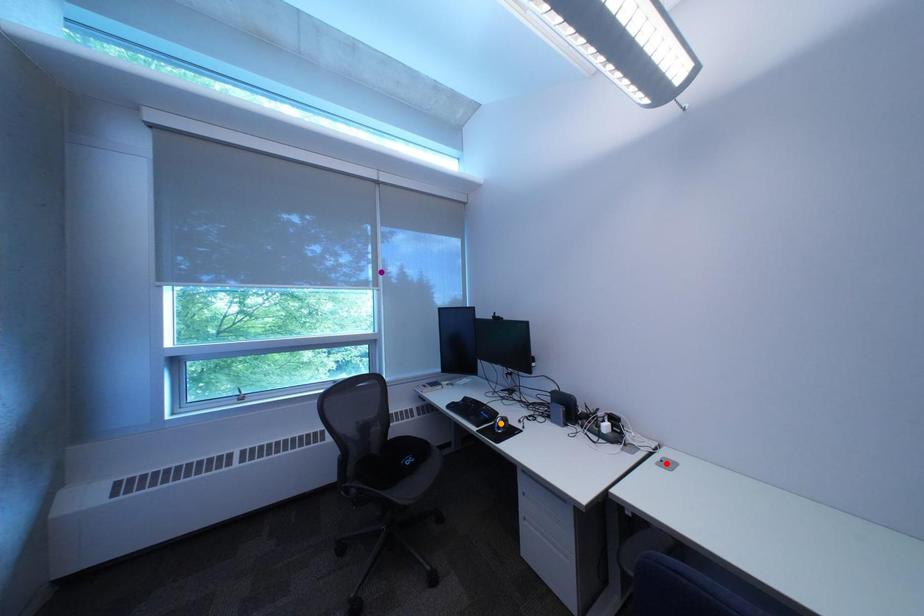
Order these from nearest to farthest:
1. orange point
2. red point
3. purple point

red point
orange point
purple point